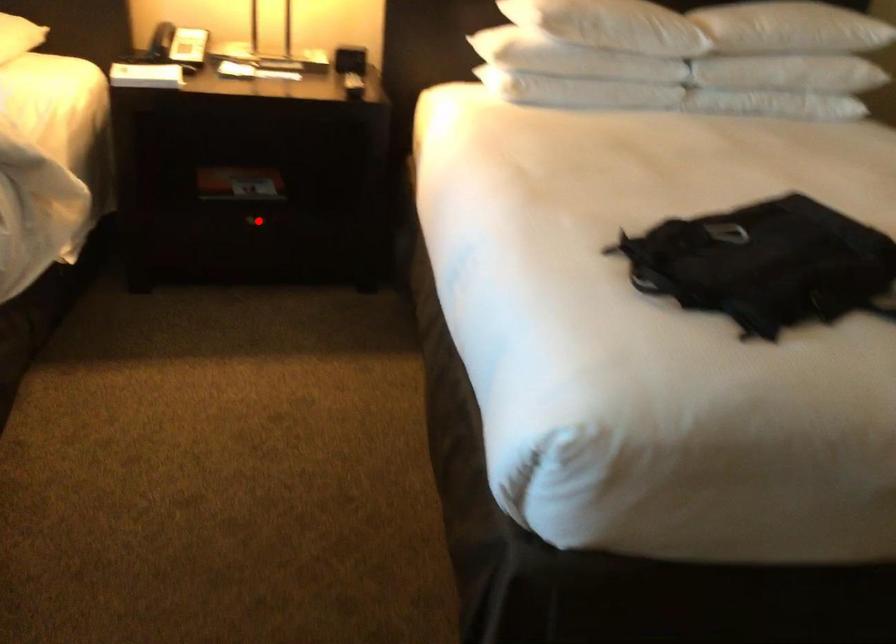
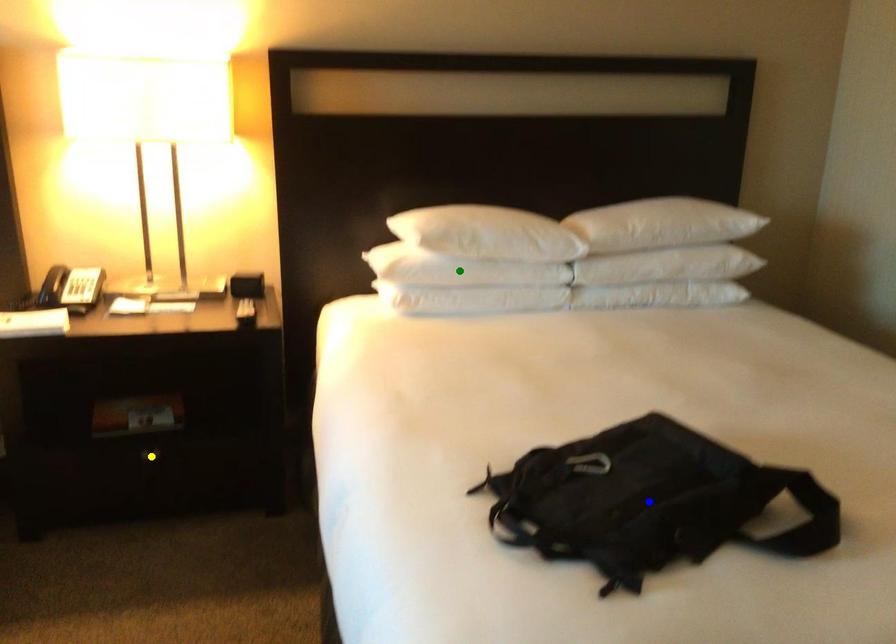
Question: I am providing you with two images of the same scene from different viewpoints. A red point is marked on the first image. You are given multiple points on the second image. In image 2, which mark is for the same physical point as the one in image 1?

Choices:
 (A) blue point
 (B) green point
 (C) yellow point

Answer: (C)